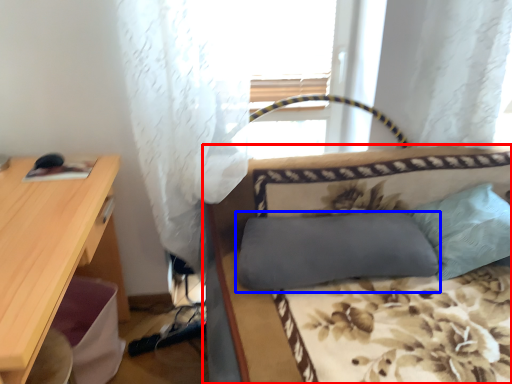
Question: Which point is closer to the camera, studio couch (highlighted by a red box) or pillow (highlighted by a blue box)?

Choices:
 (A) studio couch
 (B) pillow

Answer: (A)